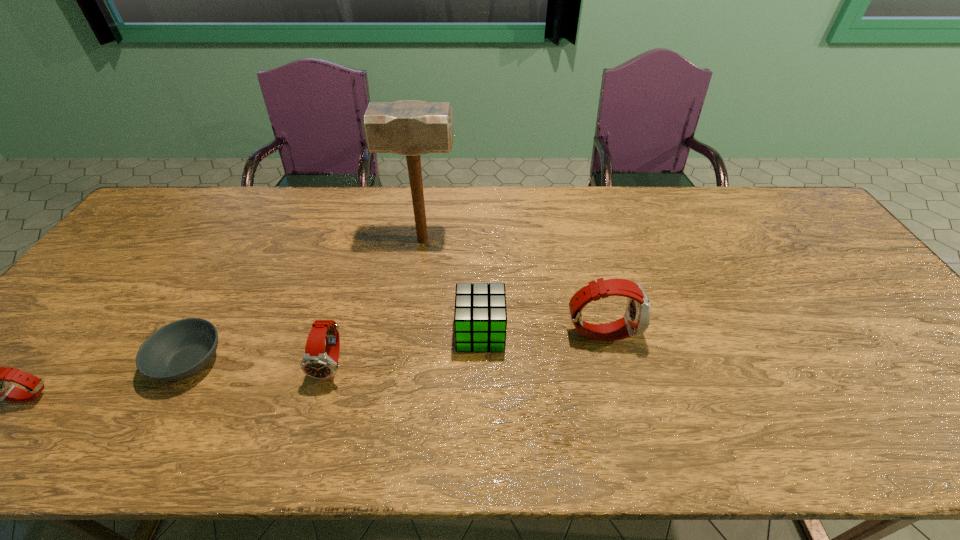
The width and height of the screenshot is (960, 540). Find the location of `vacant point that satisfies the following two spatial constraints: 1. on the striking face of the cube; 2. on the left side of the farthest object`. vacant point that satisfies the following two spatial constraints: 1. on the striking face of the cube; 2. on the left side of the farthest object is located at coordinates (410, 333).